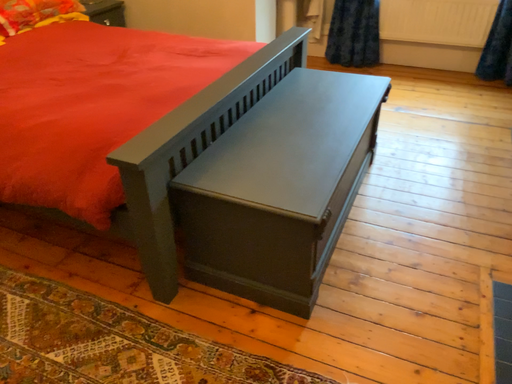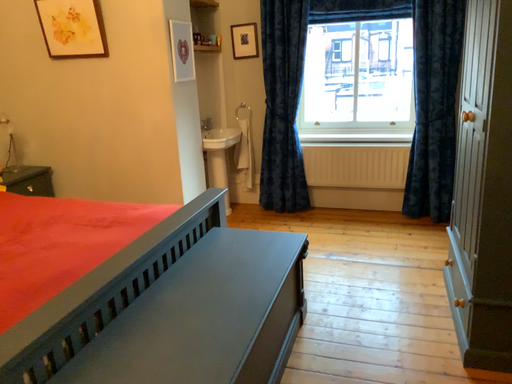
Question: Which way did the camera rotate in the video?

Choices:
 (A) rotated downward
 (B) rotated upward

Answer: (B)